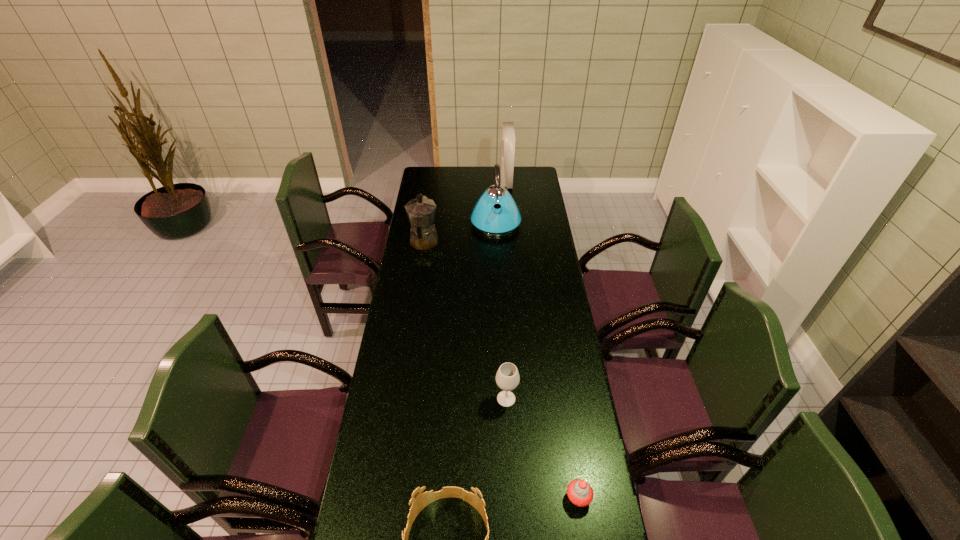
At what (x,y) coordinates should I click in order to perform the action: click on free space located 0.100m on the front-facing side of the farthest object. Please return your answer as a coordinate pair (x, y). Looking at the image, I should click on (483, 181).

Where is `vacant area situated 0.050m on the pouring side of the coffeepot`? This screenshot has width=960, height=540. vacant area situated 0.050m on the pouring side of the coffeepot is located at coordinates (427, 223).

Where is `blank space located on the pouring side of the coffeepot`? The image size is (960, 540). blank space located on the pouring side of the coffeepot is located at coordinates (429, 210).

The image size is (960, 540). Find the location of `free space located on the pouring side of the coffeepot`. free space located on the pouring side of the coffeepot is located at coordinates (430, 202).

Find the location of a particular element. The width and height of the screenshot is (960, 540). vacant space situated on the right of the wineglass is located at coordinates (564, 399).

This screenshot has height=540, width=960. Identify the location of vacant point located on the left of the shortest object. (437, 498).

The image size is (960, 540). In order to click on object present at the far edge in this screenshot , I will do `click(507, 149)`.

Image resolution: width=960 pixels, height=540 pixels. I want to click on object located in the left edge section of the desktop, so click(x=421, y=211).

The image size is (960, 540). I want to click on kettle located at the right edge, so click(487, 219).

Locate an element on the screen. cupcake at the right edge is located at coordinates (579, 492).